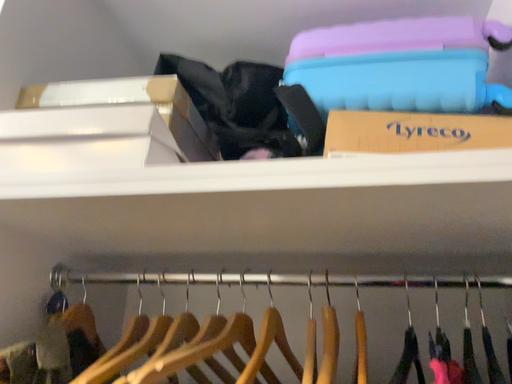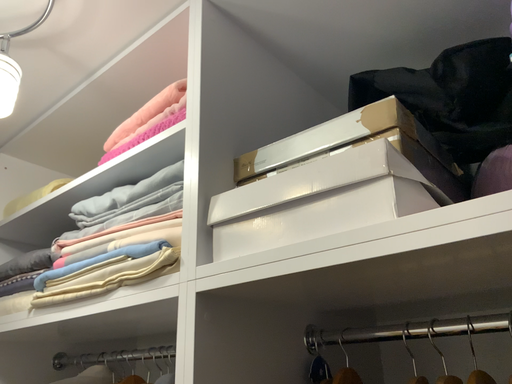
Question: How did the camera likely rotate when shooting the video?

Choices:
 (A) rotated left
 (B) rotated right

Answer: (A)